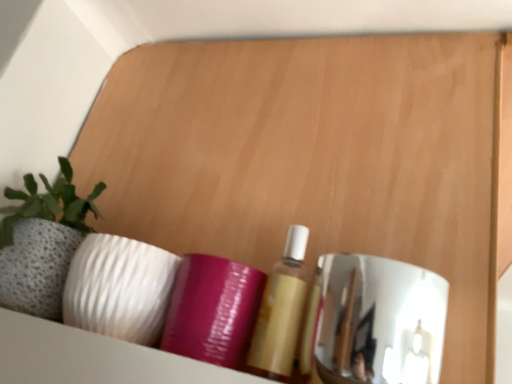
Question: From a real-world perspective, is matte gold bottle at center, marked as the second toiletry in a left-to-right arrangement, below purple glossy tube at center, the second toiletry when ordered from right to left?

Choices:
 (A) yes
 (B) no

Answer: (B)

Question: Does matte gold bottle at center, marked as the second toiletry in a left-to-right arrangement, turn towards purple glossy tube at center, the second toiletry when ordered from right to left?

Choices:
 (A) yes
 (B) no

Answer: (B)

Question: Is matte gold bottle at center, positioned as the first toiletry in right-to-left order, outside of purple glossy tube at center, positioned as the 1th toiletry in left-to-right order?

Choices:
 (A) yes
 (B) no

Answer: (A)

Question: Is purple glossy tube at center, the second toiletry when ordered from right to left, a part of matte gold bottle at center, positioned as the first toiletry in right-to-left order?

Choices:
 (A) no
 (B) yes

Answer: (A)

Question: Is matte gold bottle at center, positioned as the first toiletry in right-to-left order, far from purple glossy tube at center, the second toiletry when ordered from right to left?

Choices:
 (A) no
 (B) yes

Answer: (A)

Question: In the image, is matte gold bottle at center, positioned as the first toiletry in right-to-left order, on the left side or the right side of polished chrome mirror at right?

Choices:
 (A) right
 (B) left

Answer: (B)

Question: Is point (264, 304) positioned closer to the camera than point (395, 299)?

Choices:
 (A) closer
 (B) farther

Answer: (B)

Question: From the image's perspective, relative to polished chrome mirror at right, is matte gold bottle at center, positioned as the first toiletry in right-to-left order, above or below?

Choices:
 (A) below
 (B) above

Answer: (B)

Question: Is matte gold bottle at center, positioned as the first toiletry in right-to-left order, inside the boundaries of polished chrome mirror at right, or outside?

Choices:
 (A) inside
 (B) outside

Answer: (B)

Question: Looking at their shapes, would you say purple glossy tube at center, positioned as the 1th toiletry in left-to-right order, is wider or thinner than polished chrome mirror at right?

Choices:
 (A) wide
 (B) thin

Answer: (B)

Question: From a real-world perspective, is purple glossy tube at center, the second toiletry when ordered from right to left, above or below polished chrome mirror at right?

Choices:
 (A) below
 (B) above

Answer: (A)

Question: Is point (196, 299) closer or farther from the camera than point (340, 268)?

Choices:
 (A) farther
 (B) closer

Answer: (A)

Question: Is purple glossy tube at center, positioned as the 1th toiletry in left-to-right order, inside the boundaries of polished chrome mirror at right, or outside?

Choices:
 (A) inside
 (B) outside

Answer: (B)

Question: In the image, is matte gold bottle at center, marked as the second toiletry in a left-to-right arrangement, positioned in front of or behind purple glossy tube at center, the second toiletry when ordered from right to left?

Choices:
 (A) behind
 (B) front

Answer: (B)

Question: From the image's perspective, relative to purple glossy tube at center, positioned as the 1th toiletry in left-to-right order, is matte gold bottle at center, positioned as the first toiletry in right-to-left order, above or below?

Choices:
 (A) above
 (B) below

Answer: (B)